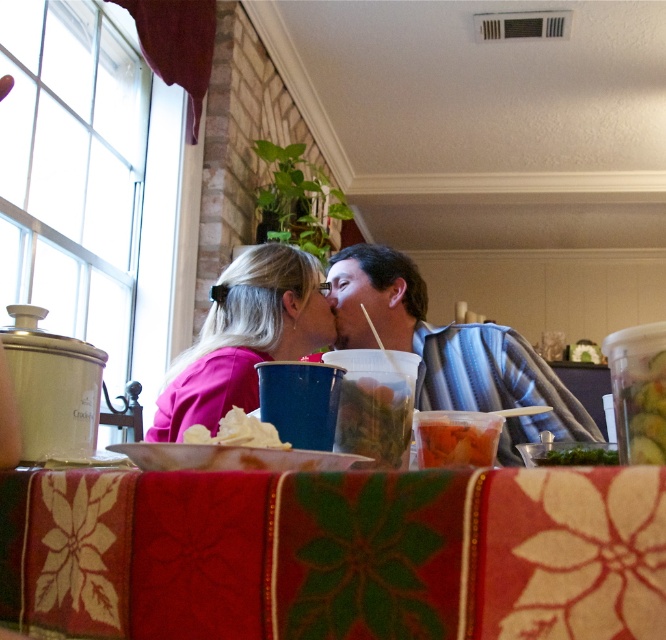
You are a guest at this table and want to place your phone on the table without covering any items. The pink matte shirt at center and white crumpled paper at center are in the way. Which item should you move to the right to make space?

You should move the pink matte shirt at center to the right since it is to the left of the white crumpled paper at center, allowing space to place your phone without covering other items.